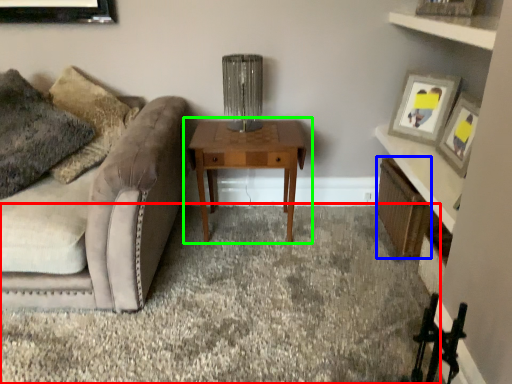
Question: Which is nearer to the plain (highlighted by a red box)? shelf (highlighted by a blue box) or table (highlighted by a green box).

Choices:
 (A) shelf
 (B) table

Answer: (B)